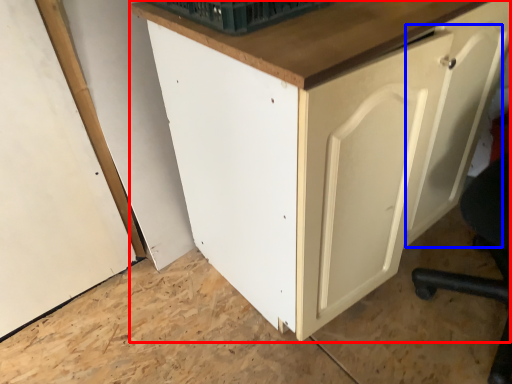
Question: Among these objects, which one is farthest to the camera, cabinetry (highlighted by a red box) or door (highlighted by a blue box)?

Choices:
 (A) cabinetry
 (B) door

Answer: (B)